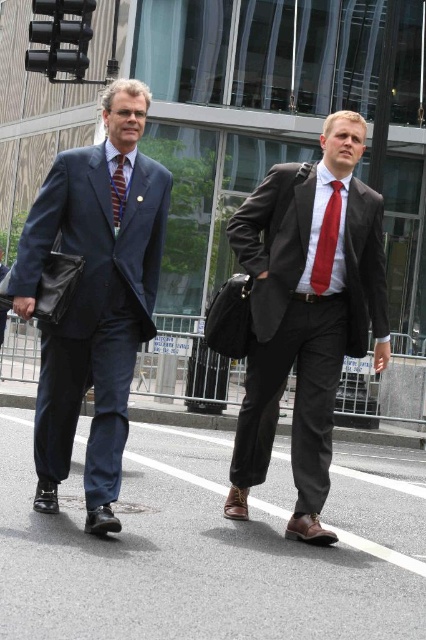
Question: Among these objects, which one is nearest to the camera?

Choices:
 (A) matte black suit at center
 (B) red satin tie at center
 (C) striped silk tie at center
 (D) matte navy suit at left

Answer: (D)

Question: Does matte navy suit at left appear on the left side of striped silk tie at center?

Choices:
 (A) yes
 (B) no

Answer: (A)

Question: Estimate the real-world distances between objects in this image. Which object is farther from the striped silk tie at center?

Choices:
 (A) matte navy suit at left
 (B) red satin tie at center
 (C) matte black suit at center

Answer: (C)

Question: Is matte black suit at center smaller than red satin tie at center?

Choices:
 (A) yes
 (B) no

Answer: (B)

Question: Which is nearer to the striped silk tie at center?

Choices:
 (A) matte black suit at center
 (B) matte navy suit at left

Answer: (B)

Question: Observing the image, what is the correct spatial positioning of matte black suit at center in reference to striped silk tie at center?

Choices:
 (A) below
 (B) above

Answer: (A)